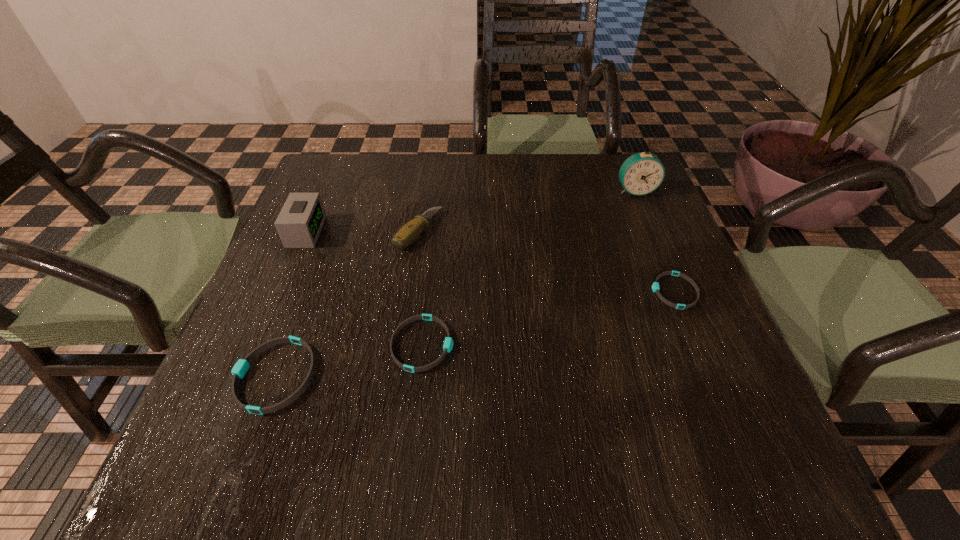
Locate an element on the screen. location for an additional wristband to make spacing equal is located at coordinates (555, 316).